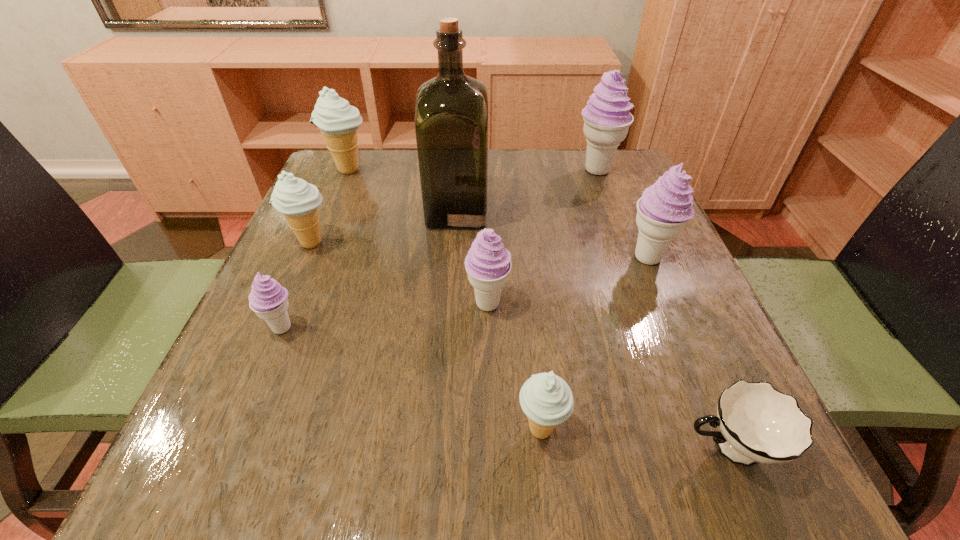
Identify which purple icecream is the third closest to the second farthest beige icecream. Please provide its 2D coordinates. Your answer should be formatted as a tuple, i.e. [(x, y)], where the tuple contains the x and y coordinates of a point satisfying the conditions above.

[(607, 118)]

At what (x,y) coordinates should I click in order to perform the action: click on the second closest beige icecream to the tallest object. Please return your answer as a coordinate pair (x, y). This screenshot has height=540, width=960. Looking at the image, I should click on (296, 199).

I want to click on beige icecream object that ranks as the third closest to the tallest object, so click(x=546, y=399).

The height and width of the screenshot is (540, 960). Identify the location of vacant point that satisfies the following two spatial constraints: 1. on the front side of the second farthest purple icecream; 2. on the right side of the biggest beige icecream. (312, 258).

Identify the location of vacant space that satisfies the following two spatial constraints: 1. on the front side of the second nearest beige icecream; 2. on the left side of the leftmost purple icecream. (275, 328).

The height and width of the screenshot is (540, 960). Identify the location of blank space that satisfies the following two spatial constraints: 1. on the back side of the third purple icecream from right to left; 2. on the label of the liquor. (486, 210).

Find the location of a particular element. free region that satisfies the following two spatial constraints: 1. on the label of the liquor; 2. on the front side of the second smallest beige icecream is located at coordinates (455, 243).

Locate an element on the screen. Image resolution: width=960 pixels, height=540 pixels. vacant area in the image that satisfies the following two spatial constraints: 1. on the front side of the second smallest purple icecream; 2. on the right side of the rightmost beige icecream is located at coordinates (490, 429).